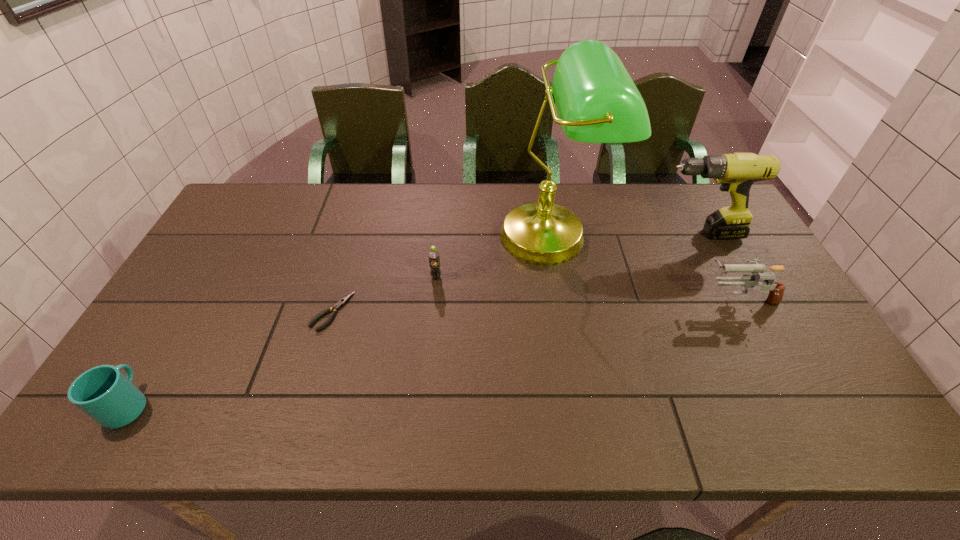
I want to click on free location located 0.380m on the handle side of the fifth shortest object, so click(x=534, y=234).

This screenshot has height=540, width=960. I want to click on free spot located 0.060m on the handle side of the fifth shortest object, so click(634, 234).

This screenshot has width=960, height=540. In order to click on free space located on the handle side of the fifth shortest object in this screenshot , I will do `click(540, 234)`.

Image resolution: width=960 pixels, height=540 pixels. I want to click on vacant space situated 0.080m at the barrel end of the gun, so (x=674, y=298).

Locate an element on the screen. The image size is (960, 540). free point located 0.210m at the barrel end of the gun is located at coordinates (628, 298).

Find the location of a particular element. vacant space located 0.090m at the barrel end of the gun is located at coordinates (671, 298).

The height and width of the screenshot is (540, 960). I want to click on vacant space situated 0.180m on the front label of the third object from left to right, so click(x=431, y=331).

Where is `blank area located on the handle side of the nearest object`? blank area located on the handle side of the nearest object is located at coordinates (175, 327).

The width and height of the screenshot is (960, 540). Find the location of `vacant space located on the handle side of the nearest object`. vacant space located on the handle side of the nearest object is located at coordinates (213, 264).

You are a GUI agent. You are given a task and a screenshot of the screen. Output one action in this format:
    pyautogui.click(x=<x>, y=<y>)
    Task: Click on the vacant area located on the handle side of the nearest object
    The width and height of the screenshot is (960, 540).
    Given the screenshot: What is the action you would take?
    pyautogui.click(x=195, y=293)